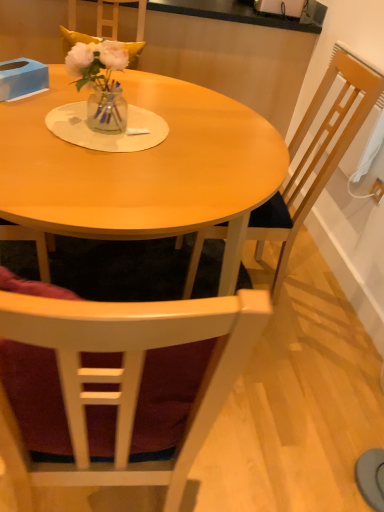
Question: From a real-world perspective, is blue cardboard box at upper left over translucent glass vase at center?

Choices:
 (A) yes
 (B) no

Answer: (B)

Question: Is blue cardboard box at upper left further to the viewer compared to translucent glass vase at center?

Choices:
 (A) yes
 (B) no

Answer: (A)

Question: Does blue cardboard box at upper left have a greater width compared to translucent glass vase at center?

Choices:
 (A) yes
 (B) no

Answer: (B)

Question: Is blue cardboard box at upper left to the left of translucent glass vase at center from the viewer's perspective?

Choices:
 (A) yes
 (B) no

Answer: (A)

Question: Is translucent glass vase at center a part of blue cardboard box at upper left?

Choices:
 (A) yes
 (B) no

Answer: (B)

Question: From a real-world perspective, is wooden chair at right, the second chair when ordered from bottom to top, above or below blue cardboard box at upper left?

Choices:
 (A) below
 (B) above

Answer: (A)

Question: From their relative heights in the image, would you say wooden chair at right, the second chair when ordered from bottom to top, is taller or shorter than blue cardboard box at upper left?

Choices:
 (A) short
 (B) tall

Answer: (B)

Question: Is wooden chair at right, positioned as the 1th chair in top-to-bottom order, inside the boundaries of blue cardboard box at upper left, or outside?

Choices:
 (A) inside
 (B) outside

Answer: (B)

Question: From the image's perspective, is wooden chair at right, the second chair when ordered from bottom to top, positioned above or below blue cardboard box at upper left?

Choices:
 (A) above
 (B) below

Answer: (B)

Question: From their relative heights in the image, would you say blue cardboard box at upper left is taller or shorter than white plastic power outlet at upper right?

Choices:
 (A) short
 (B) tall

Answer: (B)

Question: In the image, is blue cardboard box at upper left positioned in front of or behind white plastic power outlet at upper right?

Choices:
 (A) behind
 (B) front

Answer: (B)

Question: From a real-world perspective, is blue cardboard box at upper left physically located above or below white plastic power outlet at upper right?

Choices:
 (A) above
 (B) below

Answer: (A)

Question: Looking at their shapes, would you say blue cardboard box at upper left is wider or thinner than white plastic power outlet at upper right?

Choices:
 (A) wide
 (B) thin

Answer: (A)

Question: Do you think matte wood table at center is within translucent glass vase at center, or outside of it?

Choices:
 (A) outside
 (B) inside

Answer: (A)

Question: In terms of height, does matte wood table at center look taller or shorter compared to translucent glass vase at center?

Choices:
 (A) short
 (B) tall

Answer: (B)